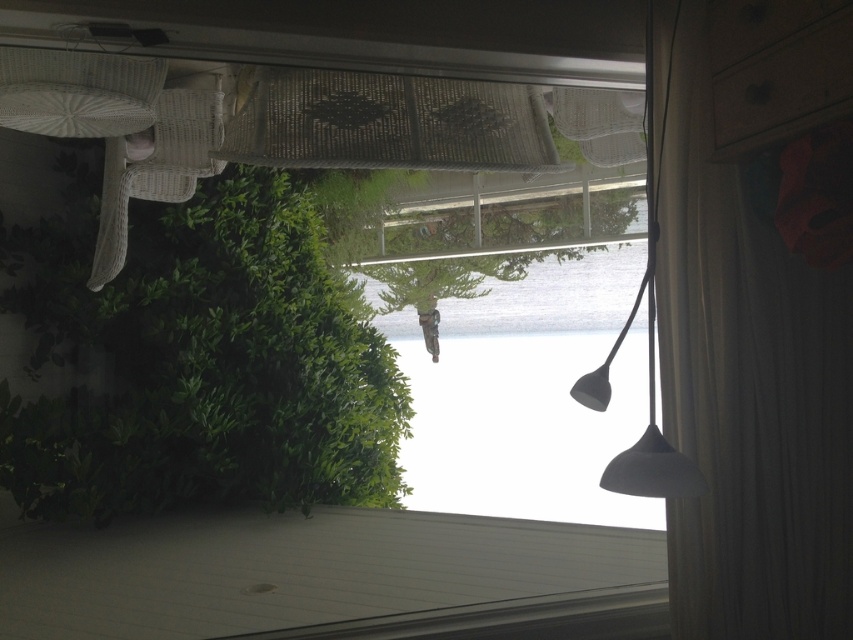
Question: Considering the real-world distances, which object is farthest from the black matte lamp at center?

Choices:
 (A) green leafy bush at left
 (B) white sheer curtain at lower right
 (C) transparent glass window at center

Answer: (C)

Question: Can you confirm if white sheer curtain at lower right is positioned above black matte lamp at center?

Choices:
 (A) no
 (B) yes

Answer: (A)

Question: Which object is positioned farthest from the green leafy bush at left?

Choices:
 (A) white sheer curtain at lower right
 (B) black matte lamp at center
 (C) transparent glass window at center

Answer: (A)

Question: Is transparent glass window at center to the right of black matte lamp at center from the viewer's perspective?

Choices:
 (A) no
 (B) yes

Answer: (A)

Question: Is white sheer curtain at lower right wider than black matte lamp at center?

Choices:
 (A) no
 (B) yes

Answer: (B)

Question: Which object appears closest to the camera in this image?

Choices:
 (A) green leafy bush at left
 (B) transparent glass window at center

Answer: (A)